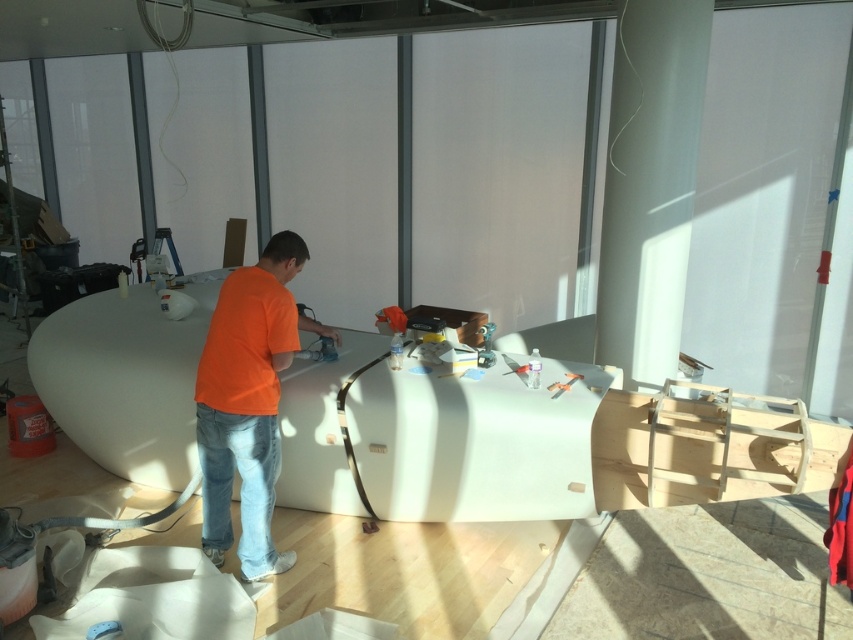
Question: Where is orange cotton shirt at center located in relation to denim at center in the image?

Choices:
 (A) right
 (B) left

Answer: (A)

Question: Among these points, which one is farthest from the camera?

Choices:
 (A) (230, 461)
 (B) (233, 436)

Answer: (A)

Question: Can you confirm if orange cotton shirt at center is positioned below denim at center?

Choices:
 (A) yes
 (B) no

Answer: (B)

Question: Can you confirm if orange cotton shirt at center is positioned above denim at center?

Choices:
 (A) yes
 (B) no

Answer: (A)